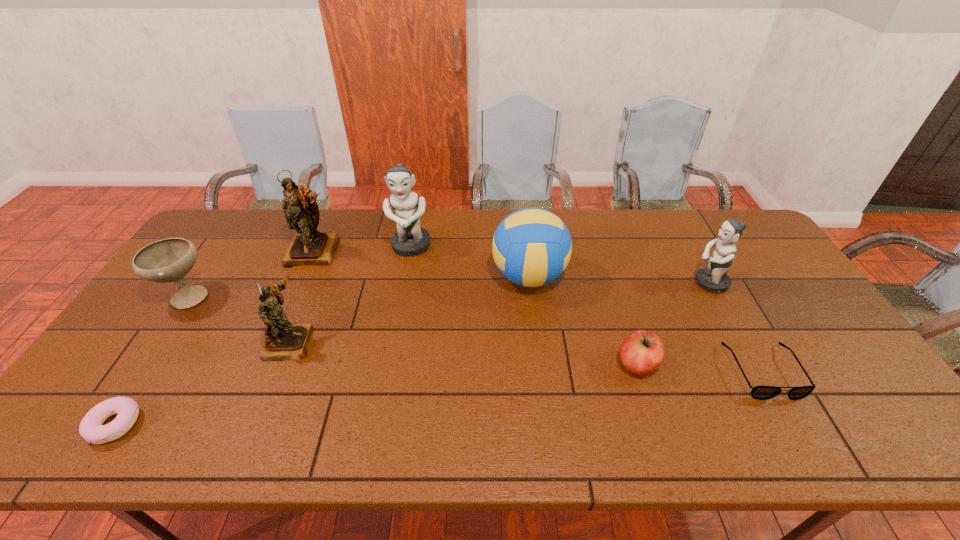
Image resolution: width=960 pixels, height=540 pixels. Identify the location of vacant space located on the front-facing side of the rightmost figurine. (655, 283).

Identify the location of free space located on the front-facing side of the rightmost figurine. [615, 283].

Locate an element on the screen. The image size is (960, 540). blank space located on the front-facing side of the rightmost figurine is located at coordinates (655, 283).

This screenshot has width=960, height=540. Identify the location of vacant point located on the front of the chalice. (164, 332).

This screenshot has width=960, height=540. I want to click on free location located 0.170m on the front of the third shortest object, so click(663, 448).

Image resolution: width=960 pixels, height=540 pixels. In order to click on free region located 0.200m on the right of the doughnut in this screenshot , I will do `click(227, 424)`.

Find the location of a particular element. Image resolution: width=960 pixels, height=540 pixels. object that is at the near edge is located at coordinates (91, 428).

Where is `chalice positioned at the left edge`? chalice positioned at the left edge is located at coordinates (169, 260).

Locate an element on the screen. Image resolution: width=960 pixels, height=540 pixels. doughnut that is at the left edge is located at coordinates (91, 428).

In order to click on object that is positioned at the near left corner in this screenshot , I will do `click(91, 428)`.